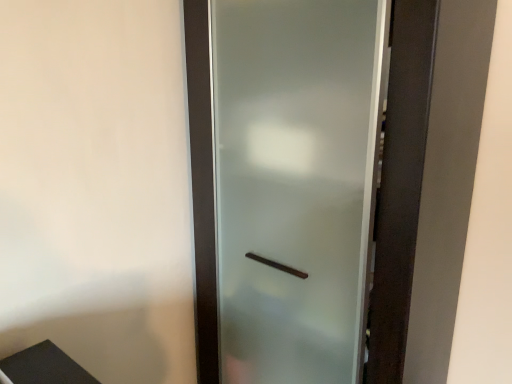
Question: Should I look upward or downward to see frosted glass door at center?

Choices:
 (A) up
 (B) down

Answer: (B)